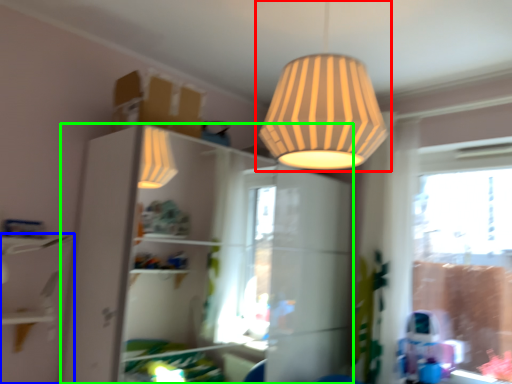
Question: Considering the real-world distances, which object is farthest from lamp (highlighted by a red box)? shelf (highlighted by a blue box) or dresser (highlighted by a green box)?

Choices:
 (A) shelf
 (B) dresser

Answer: (B)